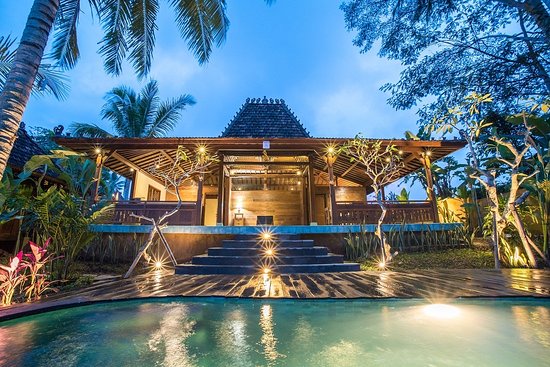
Where is `left corner post`? The width and height of the screenshot is (550, 367). left corner post is located at coordinates (94, 184).